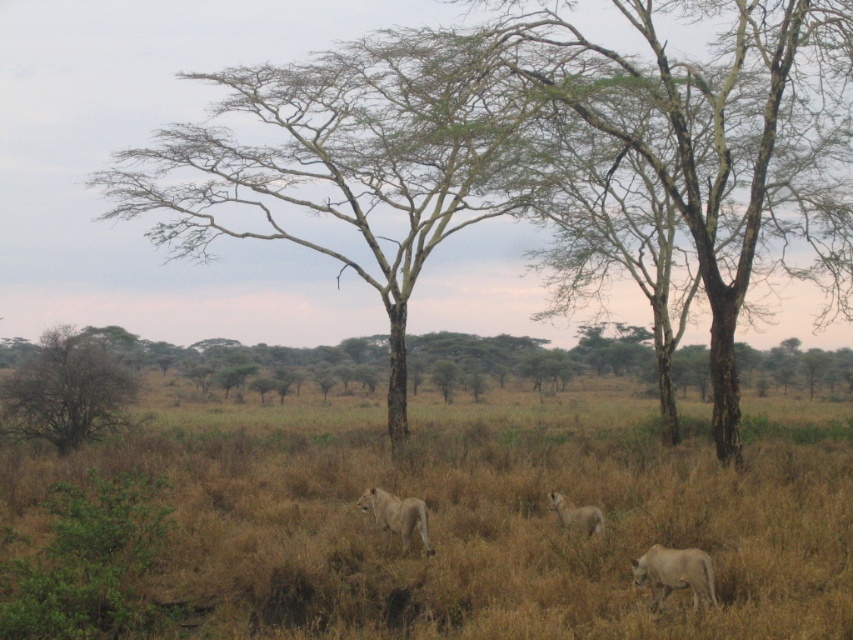
Is golden fur lion at lower right closer to the viewer compared to golden fur lion at center?

Yes, golden fur lion at lower right is in front of golden fur lion at center.

Is point (635, 582) positioned in front of point (402, 499)?

Yes, it is in front of point (402, 499).

The width and height of the screenshot is (853, 640). Find the location of `golden fur lion at lower right`. golden fur lion at lower right is located at coordinates (675, 573).

Which of these two, golden fur lion at lower right or light brown fur lion at center, stands shorter?

light brown fur lion at center

Does golden fur lion at lower right appear on the right side of light brown fur lion at center?

Correct, you'll find golden fur lion at lower right to the right of light brown fur lion at center.

What are the coordinates of `golden fur lion at lower right` in the screenshot? It's located at (675, 573).

Who is shorter, golden fur lion at center or light brown fur lion at center?

Standing shorter between the two is light brown fur lion at center.

In the scene shown: Does golden fur lion at center have a lesser height compared to light brown fur lion at center?

In fact, golden fur lion at center may be taller than light brown fur lion at center.

Which is behind, point (409, 532) or point (550, 504)?

Point (550, 504)

Identify the location of golden fur lion at center. The height and width of the screenshot is (640, 853). (397, 515).